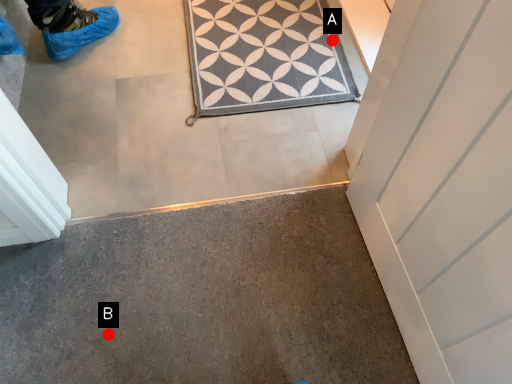
Question: Two points are circled on the image, labeled by A and B beside each circle. Among these points, which one is nearest to the camera?

Choices:
 (A) A is closer
 (B) B is closer

Answer: (B)